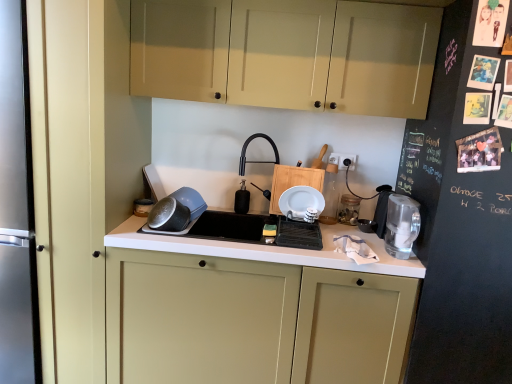
The image size is (512, 384). I want to click on vacant space to the left of black matte faucet at center, so click(x=221, y=215).